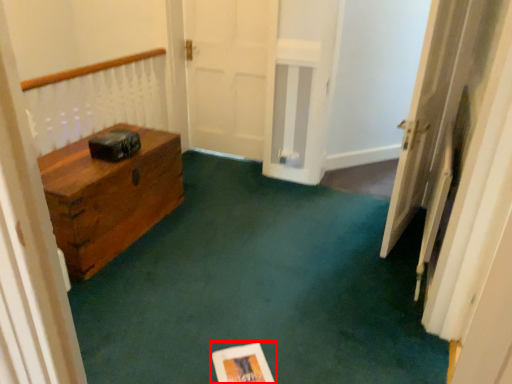
Question: Observing the image, what is the correct spatial positioning of copy (annotated by the red box) in reference to door?

Choices:
 (A) right
 (B) left

Answer: (B)